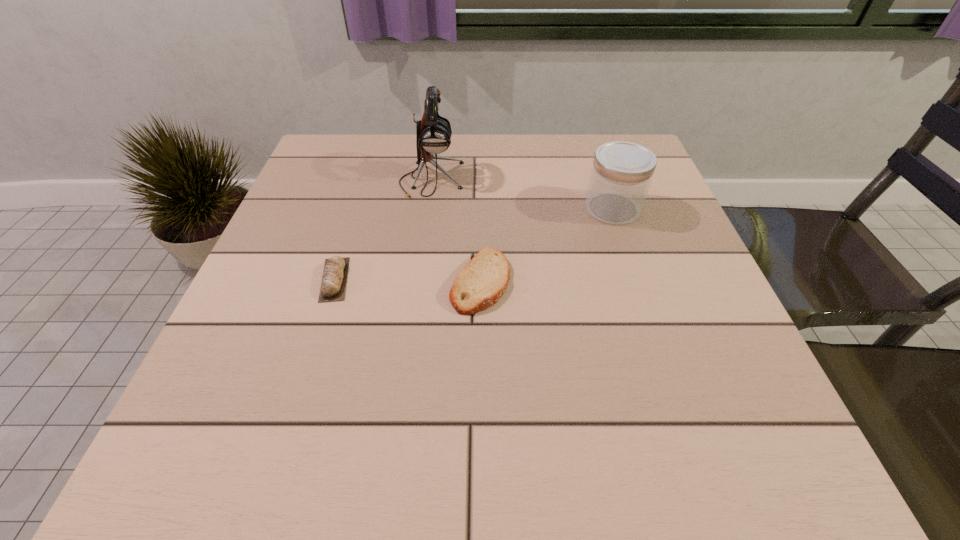
Identify the location of the tallest object. (433, 133).

Find the location of a particular element. This screenshot has width=960, height=540. the third shortest object is located at coordinates (621, 174).

Identify the location of the rightmost object. (621, 174).

The image size is (960, 540). I want to click on the right pita bread, so click(x=482, y=282).

I want to click on the leftmost object, so click(x=333, y=285).

You are a GUI agent. You are given a task and a screenshot of the screen. Output one action in this format:
    pyautogui.click(x=<x>, y=<y>)
    Task: Click on the vacant region located on the left of the tallest object
    The height and width of the screenshot is (540, 960).
    Given the screenshot: What is the action you would take?
    pyautogui.click(x=375, y=179)

The image size is (960, 540). I want to click on free spot located on the left of the jar, so click(440, 208).

Image resolution: width=960 pixels, height=540 pixels. I want to click on vacant space located on the back of the right pita bread, so click(x=480, y=171).

Identify the location of free space located on the left of the left pita bread. (277, 279).

What are the coordinates of `object that is at the far edge` in the screenshot? It's located at (433, 133).